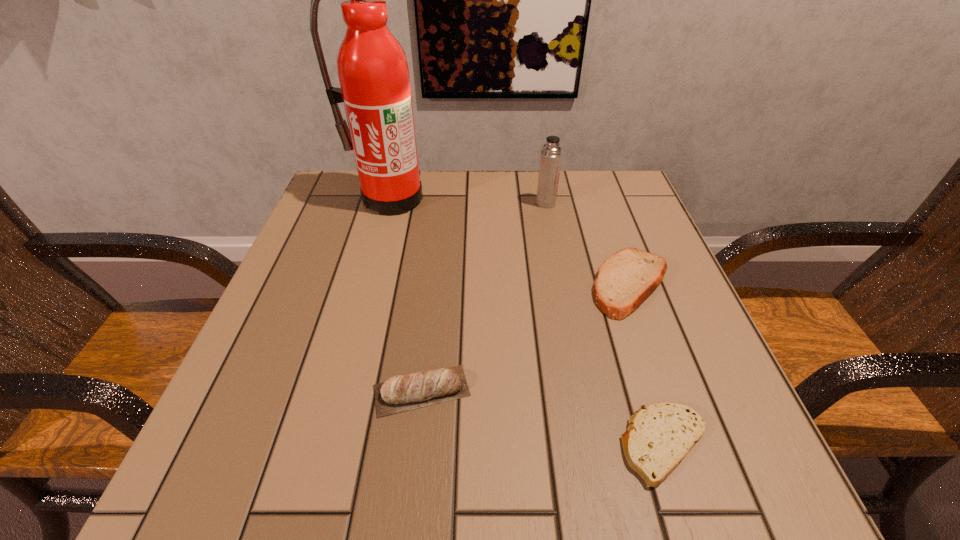
Where is `free space at the far left corner`? free space at the far left corner is located at coordinates (353, 223).

In order to click on vacant space at the far right corner of the desktop in this screenshot , I will do `click(614, 212)`.

The width and height of the screenshot is (960, 540). I want to click on free space between the shortest object and the thermos bottle, so click(x=605, y=324).

Where is `free space between the leftmost pita bread and the tallest object`? This screenshot has width=960, height=540. free space between the leftmost pita bread and the tallest object is located at coordinates (406, 295).

Identify the location of free area in between the leftmost pita bread and the fourth shortest object. (484, 297).

What are the coordinates of `vacant area that lies between the leftmost pita bread and the fire extinguisher` in the screenshot? It's located at (406, 295).

This screenshot has width=960, height=540. What are the coordinates of `vacant point located between the fire extinguisher and the farthest pita bread` in the screenshot? It's located at (510, 242).

This screenshot has height=540, width=960. What are the coordinates of `empty space between the leftmost pita bread and the third object from right to left` in the screenshot? It's located at (484, 297).

You are a GUI agent. You are given a task and a screenshot of the screen. Output one action in this format:
    pyautogui.click(x=<x>, y=<y>)
    Task: Click on the empty location between the fourth shortest object and the farthest pita bread
    The image size is (960, 540).
    Given the screenshot: What is the action you would take?
    pyautogui.click(x=588, y=244)

Identify the location of unoccupied area between the third nearest object and the third object from right to left. (588, 244).